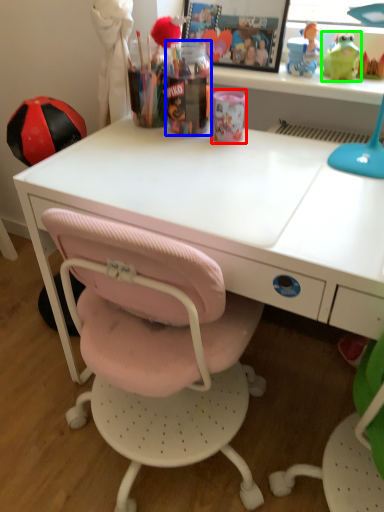
Question: Which object is positioned farthest from stationery (highlighted by a red box)? Select from stationery (highlighted by a blue box) and toy (highlighted by a green box).

Choices:
 (A) stationery
 (B) toy

Answer: (B)